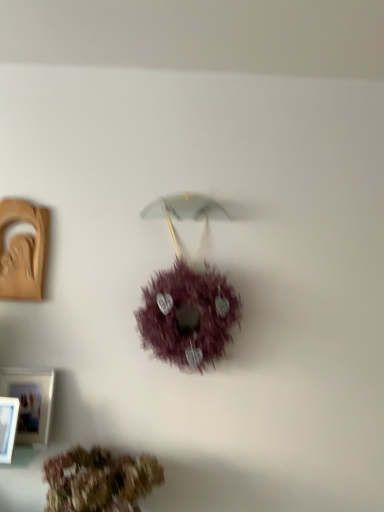
What do you see at coordinates (30, 402) in the screenshot? This screenshot has height=512, width=384. I see `white matte picture frame at lower left, acting as the 2th picture frame starting from the front` at bounding box center [30, 402].

Identify the location of white matte picture frame at lower left, the second picture frame in the back-to-front sequence. (30, 402).

How much space does white plastic picture frame at lower left, which ranks as the 1th picture frame in front-to-back order, occupy vertically?

9.15 inches.

Describe the element at coordinates (188, 315) in the screenshot. I see `purple fluffy wreath at center, the second flower ordered from the bottom` at that location.

Find the location of a particular element. The width and height of the screenshot is (384, 512). matte brown picture frame at left, the 1th picture frame positioned from the top is located at coordinates (23, 251).

What do you see at coordinates (23, 251) in the screenshot? I see `matte brown picture frame at left, the 1th picture frame in the back-to-front sequence` at bounding box center [23, 251].

Describe the element at coordinates (99, 480) in the screenshot. I see `brown textured wreath at lower center, which ranks as the first flower in bottom-to-top order` at that location.

How much space does brown textured wreath at lower center, which ranks as the first flower in bottom-to-top order, occupy vertically?

brown textured wreath at lower center, which ranks as the first flower in bottom-to-top order, is 10.74 inches tall.

The image size is (384, 512). What are the coordinates of `white matte picture frame at lower left, the second picture frame in the back-to-front sequence` in the screenshot? It's located at (30, 402).

Is white plastic picture frame at lower left, which is the third picture frame from back to front, inside brown textured wreath at lower center, marked as the second flower in a top-to-bottom arrangement?

No, white plastic picture frame at lower left, which is the third picture frame from back to front, is not inside brown textured wreath at lower center, marked as the second flower in a top-to-bottom arrangement.

Is the depth of brown textured wreath at lower center, which ranks as the first flower in bottom-to-top order, greater than that of white plastic picture frame at lower left, marked as the 3th picture frame in a top-to-bottom arrangement?

No, brown textured wreath at lower center, which ranks as the first flower in bottom-to-top order, is closer to the camera.

Does brown textured wreath at lower center, which ranks as the first flower in bottom-to-top order, have a larger size compared to white plastic picture frame at lower left, which ranks as the 1th picture frame in front-to-back order?

Yes.

From the image's perspective, is brown textured wreath at lower center, marked as the second flower in a top-to-bottom arrangement, located above white plastic picture frame at lower left, marked as the 3th picture frame in a top-to-bottom arrangement?

No, from the image's perspective, brown textured wreath at lower center, marked as the second flower in a top-to-bottom arrangement, is not above white plastic picture frame at lower left, marked as the 3th picture frame in a top-to-bottom arrangement.

Is matte brown picture frame at left, the 3th picture frame when ordered from front to back, in front of purple fluffy wreath at center, which is counted as the 1th flower, starting from the top?

No, it is not.

Is matte brown picture frame at left, which is counted as the 3th picture frame, starting from the bottom, facing away from purple fluffy wreath at center, which is counted as the 1th flower, starting from the top?

matte brown picture frame at left, which is counted as the 3th picture frame, starting from the bottom, is not turned away from purple fluffy wreath at center, which is counted as the 1th flower, starting from the top.

Would you say matte brown picture frame at left, the 1th picture frame in the back-to-front sequence, is outside purple fluffy wreath at center, the second flower ordered from the bottom?

Absolutely, matte brown picture frame at left, the 1th picture frame in the back-to-front sequence, is external to purple fluffy wreath at center, the second flower ordered from the bottom.

From their relative heights in the image, would you say matte brown picture frame at left, the 1th picture frame positioned from the top, is taller or shorter than purple fluffy wreath at center, the second flower ordered from the bottom?

matte brown picture frame at left, the 1th picture frame positioned from the top, is shorter than purple fluffy wreath at center, the second flower ordered from the bottom.

Based on the photo, from the image's perspective, is purple fluffy wreath at center, which is counted as the 1th flower, starting from the top, under white matte picture frame at lower left, arranged as the 2th picture frame when ordered from the bottom?

No, from the image's perspective, purple fluffy wreath at center, which is counted as the 1th flower, starting from the top, is not beneath white matte picture frame at lower left, arranged as the 2th picture frame when ordered from the bottom.

Is point (154, 301) closer or farther from the camera than point (19, 415)?

Clearly, point (154, 301) is more distant from the camera than point (19, 415).

Can you confirm if purple fluffy wreath at center, which is counted as the 1th flower, starting from the top, is shorter than white matte picture frame at lower left, acting as the 2th picture frame starting from the front?

In fact, purple fluffy wreath at center, which is counted as the 1th flower, starting from the top, may be taller than white matte picture frame at lower left, acting as the 2th picture frame starting from the front.

Considering the sizes of objects purple fluffy wreath at center, which is counted as the 1th flower, starting from the top, and white matte picture frame at lower left, arranged as the 2th picture frame when ordered from the bottom, in the image provided, who is thinner, purple fluffy wreath at center, which is counted as the 1th flower, starting from the top, or white matte picture frame at lower left, arranged as the 2th picture frame when ordered from the bottom,?

white matte picture frame at lower left, arranged as the 2th picture frame when ordered from the bottom.

Which object is wider, white matte picture frame at lower left, arranged as the 2th picture frame when ordered from the bottom, or white plastic picture frame at lower left, which ranks as the 1th picture frame in front-to-back order?

With larger width is white plastic picture frame at lower left, which ranks as the 1th picture frame in front-to-back order.

Which is nearer, (37, 372) or (7, 436)?

The point (7, 436) is closer to the camera.

Who is smaller, white matte picture frame at lower left, the second picture frame in the back-to-front sequence, or white plastic picture frame at lower left, the first picture frame when ordered from bottom to top?

With smaller size is white plastic picture frame at lower left, the first picture frame when ordered from bottom to top.

Consider the image. Considering the sizes of objects purple fluffy wreath at center, which is counted as the 1th flower, starting from the top, and brown textured wreath at lower center, marked as the second flower in a top-to-bottom arrangement, in the image provided, who is smaller, purple fluffy wreath at center, which is counted as the 1th flower, starting from the top, or brown textured wreath at lower center, marked as the second flower in a top-to-bottom arrangement,?

brown textured wreath at lower center, marked as the second flower in a top-to-bottom arrangement.

Between purple fluffy wreath at center, which is counted as the 1th flower, starting from the top, and brown textured wreath at lower center, which ranks as the first flower in bottom-to-top order, which one has more height?

Standing taller between the two is purple fluffy wreath at center, which is counted as the 1th flower, starting from the top.

Is brown textured wreath at lower center, which ranks as the first flower in bottom-to-top order, surrounded by purple fluffy wreath at center, which is counted as the 1th flower, starting from the top?

Definitely not — brown textured wreath at lower center, which ranks as the first flower in bottom-to-top order, is not inside purple fluffy wreath at center, which is counted as the 1th flower, starting from the top.

From the image's perspective, would you say purple fluffy wreath at center, the second flower ordered from the bottom, is positioned over brown textured wreath at lower center, marked as the second flower in a top-to-bottom arrangement?

Yes, from the image's perspective, purple fluffy wreath at center, the second flower ordered from the bottom, is above brown textured wreath at lower center, marked as the second flower in a top-to-bottom arrangement.

You are a GUI agent. You are given a task and a screenshot of the screen. Output one action in this format:
    pyautogui.click(x=<x>, y=<y>)
    Task: Click on the picture frame located behind the white matte picture frame at lower left, arranged as the 2th picture frame when ordered from the bottom
    This screenshot has height=512, width=384.
    Given the screenshot: What is the action you would take?
    pyautogui.click(x=23, y=251)

Which is behind, matte brown picture frame at left, the 1th picture frame positioned from the top, or white matte picture frame at lower left, acting as the 2th picture frame starting from the front?

Positioned behind is matte brown picture frame at left, the 1th picture frame positioned from the top.

From a real-world perspective, is matte brown picture frame at left, the 1th picture frame in the back-to-front sequence, positioned under white matte picture frame at lower left, acting as the 2th picture frame starting from the front, based on gravity?

No, from a real-world perspective, matte brown picture frame at left, the 1th picture frame in the back-to-front sequence, is not below white matte picture frame at lower left, acting as the 2th picture frame starting from the front.

Is matte brown picture frame at left, the 3th picture frame when ordered from front to back, facing towards white matte picture frame at lower left, arranged as the 2th picture frame when ordered from the bottom?

No, matte brown picture frame at left, the 3th picture frame when ordered from front to back, is not facing towards white matte picture frame at lower left, arranged as the 2th picture frame when ordered from the bottom.

Is brown textured wreath at lower center, which ranks as the first flower in bottom-to-top order, far from purple fluffy wreath at center, which is counted as the 1th flower, starting from the top?

Actually, brown textured wreath at lower center, which ranks as the first flower in bottom-to-top order, and purple fluffy wreath at center, which is counted as the 1th flower, starting from the top, are a little close together.

From a real-world perspective, which is physically below, brown textured wreath at lower center, marked as the second flower in a top-to-bottom arrangement, or purple fluffy wreath at center, the second flower ordered from the bottom?

brown textured wreath at lower center, marked as the second flower in a top-to-bottom arrangement, from a real-world perspective.

How distant is brown textured wreath at lower center, marked as the second flower in a top-to-bottom arrangement, from purple fluffy wreath at center, which is counted as the 1th flower, starting from the top?

brown textured wreath at lower center, marked as the second flower in a top-to-bottom arrangement, is 48.13 centimeters from purple fluffy wreath at center, which is counted as the 1th flower, starting from the top.

From the image's perspective, would you say brown textured wreath at lower center, marked as the second flower in a top-to-bottom arrangement, is positioned over purple fluffy wreath at center, the second flower ordered from the bottom?

No.

This screenshot has height=512, width=384. Identify the location of flower below the white plastic picture frame at lower left, which ranks as the 1th picture frame in front-to-back order (from the image's perspective). (99, 480).

From a real-world perspective, count 1st flowers downward from the matte brown picture frame at left, the 1th picture frame positioned from the top, and point to it. Please provide its 2D coordinates.

[(188, 315)]

Which object lies nearer to the anchor point brown textured wreath at lower center, marked as the second flower in a top-to-bottom arrangement, white matte picture frame at lower left, the second picture frame in the back-to-front sequence, or matte brown picture frame at left, the 1th picture frame in the back-to-front sequence?

white matte picture frame at lower left, the second picture frame in the back-to-front sequence, lies closer to brown textured wreath at lower center, marked as the second flower in a top-to-bottom arrangement, than the other object.

Which object lies nearer to the anchor point white plastic picture frame at lower left, which ranks as the 1th picture frame in front-to-back order, white matte picture frame at lower left, the second picture frame in the back-to-front sequence, or matte brown picture frame at left, the 1th picture frame in the back-to-front sequence?

white matte picture frame at lower left, the second picture frame in the back-to-front sequence.

From the image, which object appears to be farther from white plastic picture frame at lower left, the first picture frame when ordered from bottom to top, matte brown picture frame at left, the 3th picture frame when ordered from front to back, or purple fluffy wreath at center, the second flower ordered from the bottom?

The object further to white plastic picture frame at lower left, the first picture frame when ordered from bottom to top, is purple fluffy wreath at center, the second flower ordered from the bottom.

Considering their positions, is white plastic picture frame at lower left, which is the third picture frame from back to front, positioned further to white matte picture frame at lower left, acting as the 2th picture frame starting from the front, than purple fluffy wreath at center, which is counted as the 1th flower, starting from the top?

purple fluffy wreath at center, which is counted as the 1th flower, starting from the top, is positioned further to the anchor white matte picture frame at lower left, acting as the 2th picture frame starting from the front.

Estimate the real-world distances between objects in this image. Which object is further from white matte picture frame at lower left, the second picture frame in the back-to-front sequence, matte brown picture frame at left, the 1th picture frame positioned from the top, or white plastic picture frame at lower left, the first picture frame when ordered from bottom to top?

Based on the image, matte brown picture frame at left, the 1th picture frame positioned from the top, appears to be further to white matte picture frame at lower left, the second picture frame in the back-to-front sequence.

When comparing their distances from purple fluffy wreath at center, the second flower ordered from the bottom, does white matte picture frame at lower left, arranged as the 2th picture frame when ordered from the bottom, or matte brown picture frame at left, which is counted as the 3th picture frame, starting from the bottom, seem closer?

The object closer to purple fluffy wreath at center, the second flower ordered from the bottom, is white matte picture frame at lower left, arranged as the 2th picture frame when ordered from the bottom.

Estimate the real-world distances between objects in this image. Which object is further from white plastic picture frame at lower left, the first picture frame when ordered from bottom to top, brown textured wreath at lower center, which ranks as the first flower in bottom-to-top order, or matte brown picture frame at left, the 3th picture frame when ordered from front to back?

matte brown picture frame at left, the 3th picture frame when ordered from front to back, is further to white plastic picture frame at lower left, the first picture frame when ordered from bottom to top.

Looking at the image, which one is located closer to white plastic picture frame at lower left, which is the third picture frame from back to front, white matte picture frame at lower left, the second picture frame in the back-to-front sequence, or purple fluffy wreath at center, the second flower ordered from the bottom?

Among the two, white matte picture frame at lower left, the second picture frame in the back-to-front sequence, is located nearer to white plastic picture frame at lower left, which is the third picture frame from back to front.

This screenshot has height=512, width=384. I want to click on picture frame between matte brown picture frame at left, the 3th picture frame when ordered from front to back, and white plastic picture frame at lower left, marked as the 3th picture frame in a top-to-bottom arrangement, in the up-down direction, so click(x=30, y=402).

The height and width of the screenshot is (512, 384). Find the location of `picture frame situated between white plastic picture frame at lower left, the first picture frame when ordered from bottom to top, and brown textured wreath at lower center, marked as the second flower in a top-to-bottom arrangement, from left to right`. picture frame situated between white plastic picture frame at lower left, the first picture frame when ordered from bottom to top, and brown textured wreath at lower center, marked as the second flower in a top-to-bottom arrangement, from left to right is located at coordinates (30, 402).

Find the location of a particular element. The image size is (384, 512). flower between matte brown picture frame at left, the 1th picture frame in the back-to-front sequence, and brown textured wreath at lower center, which ranks as the first flower in bottom-to-top order, vertically is located at coordinates (188, 315).

Identify the location of picture frame between white plastic picture frame at lower left, marked as the 3th picture frame in a top-to-bottom arrangement, and purple fluffy wreath at center, which is counted as the 1th flower, starting from the top. This screenshot has height=512, width=384. (30, 402).